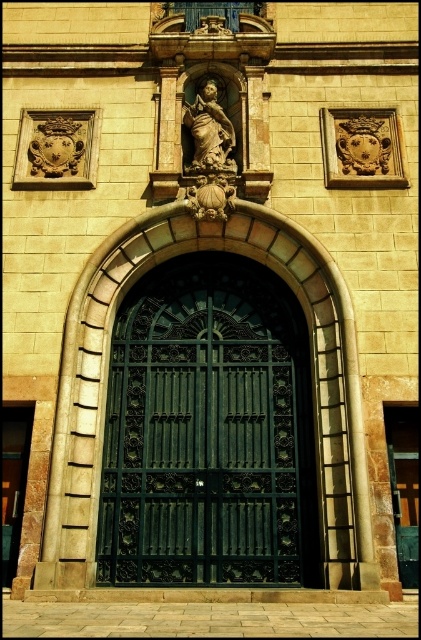
Which is below, dark green wrought iron gate at center or dark green metal gate at center?

dark green metal gate at center

Does dark green wrought iron gate at center have a larger size compared to dark green metal gate at center?

Yes, dark green wrought iron gate at center is bigger than dark green metal gate at center.

Who is more distant from viewer, (284, 452) or (400, 529)?

Positioned behind is point (284, 452).

Identify the location of dark green wrought iron gate at center. The height and width of the screenshot is (640, 421). click(208, 433).

Is dark green metal gate at center positioned behind matte stone statue at center?

No, it is in front of matte stone statue at center.

Which is more to the right, dark green metal gate at center or matte stone statue at center?

Positioned to the right is dark green metal gate at center.

Image resolution: width=421 pixels, height=640 pixels. Describe the element at coordinates (404, 486) in the screenshot. I see `dark green metal gate at center` at that location.

This screenshot has height=640, width=421. I want to click on dark green metal gate at center, so click(x=404, y=486).

Is point (292, 394) in front of point (221, 131)?

Yes.

Looking at this image, is dark green wrought iron gate at center above matte stone statue at center?

No, dark green wrought iron gate at center is not above matte stone statue at center.

Measure the distance between point (178,314) and camera.

Point (178,314) is 164.80 feet away from camera.

Find the location of a particular element. This screenshot has height=640, width=421. dark green wrought iron gate at center is located at coordinates (208, 433).